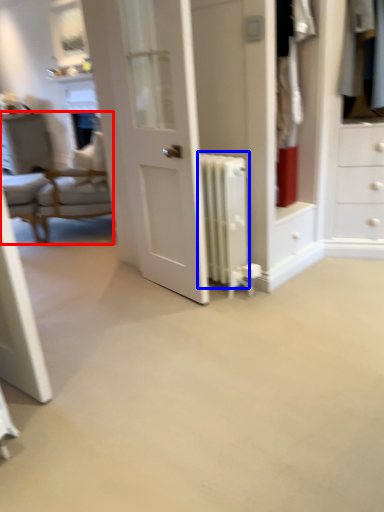
Question: Among these objects, which one is nearest to the camera, chair (highlighted by a red box) or radiator (highlighted by a blue box)?

Choices:
 (A) chair
 (B) radiator

Answer: (B)